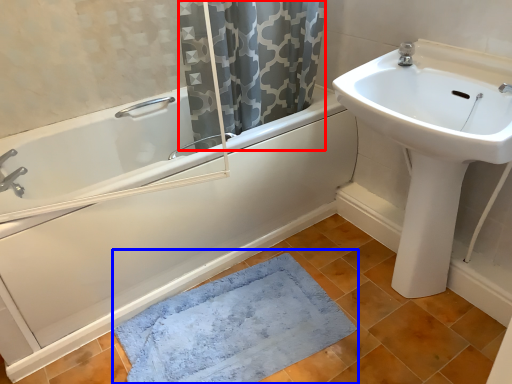
Question: Which point is closer to the camera, shower curtain (highlighted by a red box) or bath mat (highlighted by a blue box)?

Choices:
 (A) shower curtain
 (B) bath mat

Answer: (B)